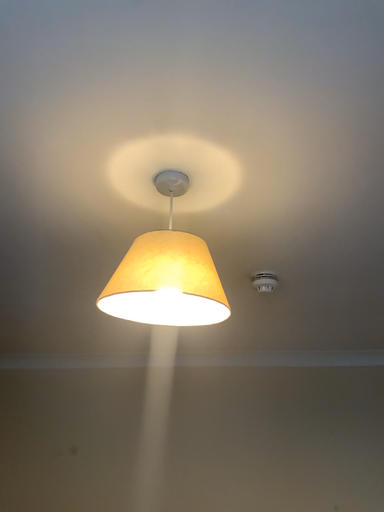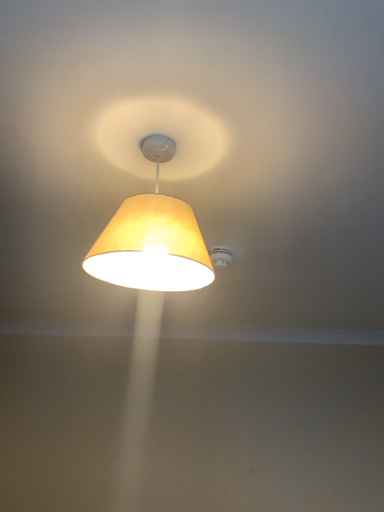
Question: Which way did the camera rotate in the video?

Choices:
 (A) rotated right
 (B) rotated left

Answer: (A)